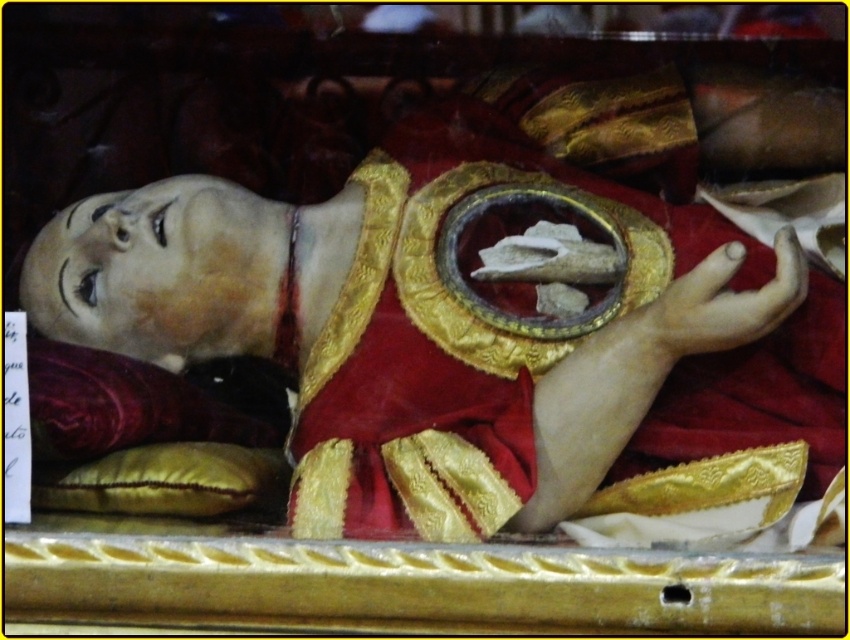
Question: Does matte gold statue at center appear on the left side of velvet cushion at lower left?

Choices:
 (A) no
 (B) yes

Answer: (A)

Question: Does velvet cushion at lower left have a smaller size compared to yellow fabric pillow at lower left?

Choices:
 (A) no
 (B) yes

Answer: (A)

Question: Estimate the real-world distances between objects in this image. Which object is closer to the velvet cushion at lower left?

Choices:
 (A) matte gold statue at center
 (B) matte gold hand at lower right
 (C) yellow fabric pillow at lower left

Answer: (C)

Question: Among these objects, which one is farthest from the camera?

Choices:
 (A) matte gold hand at lower right
 (B) yellow fabric pillow at lower left

Answer: (B)

Question: Considering the real-world distances, which object is closest to the velvet cushion at lower left?

Choices:
 (A) matte gold hand at lower right
 (B) yellow fabric pillow at lower left
 (C) matte gold statue at center

Answer: (B)

Question: Can you confirm if velvet cushion at lower left is smaller than matte gold hand at lower right?

Choices:
 (A) yes
 (B) no

Answer: (B)